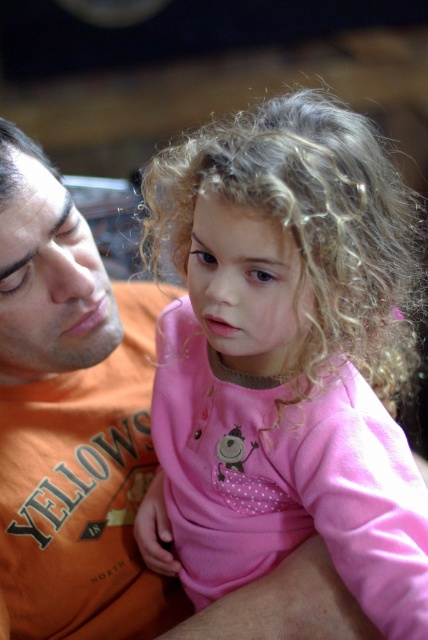
The image size is (428, 640). What are the coordinates of `pink fabric at center` in the screenshot? It's located at (285, 358).

Is pink fabric at center in front of orange cotton shirt at left?

That is True.

Does point (392, 484) come closer to viewer compared to point (29, 408)?

Yes, it is in front of point (29, 408).

Identify the location of pink fabric at center. (285, 358).